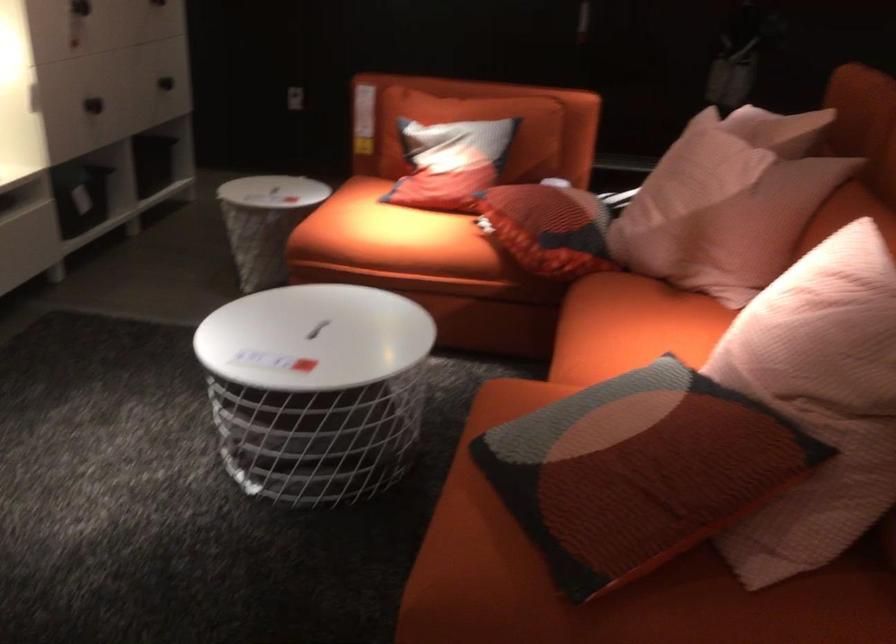
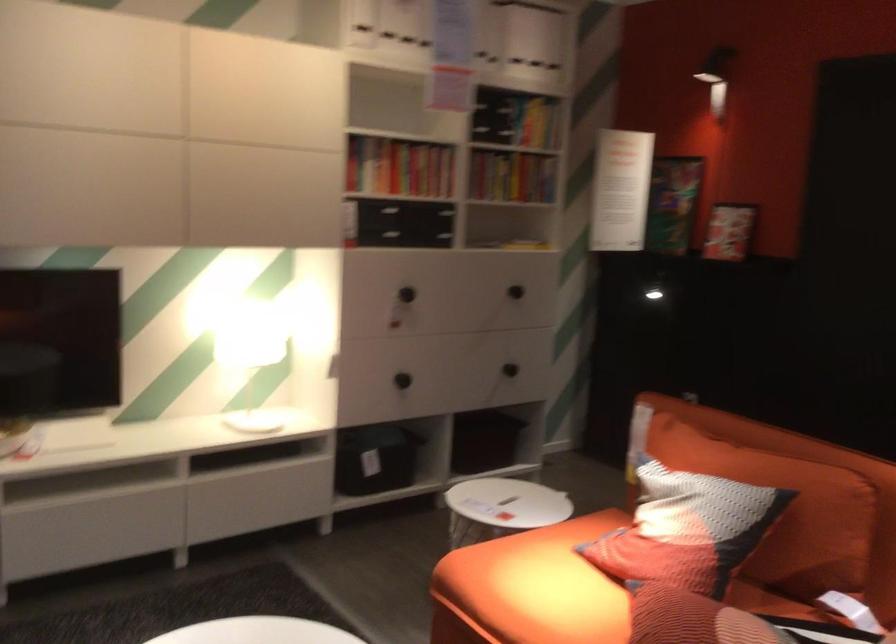
Find the pixel in the second image that matches (x=383, y=229) in the first image.

(531, 588)